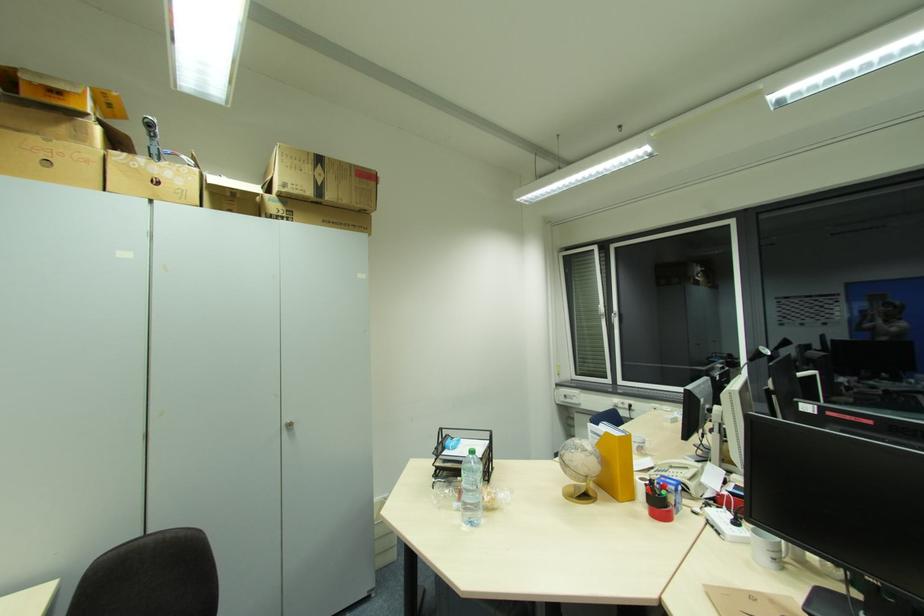
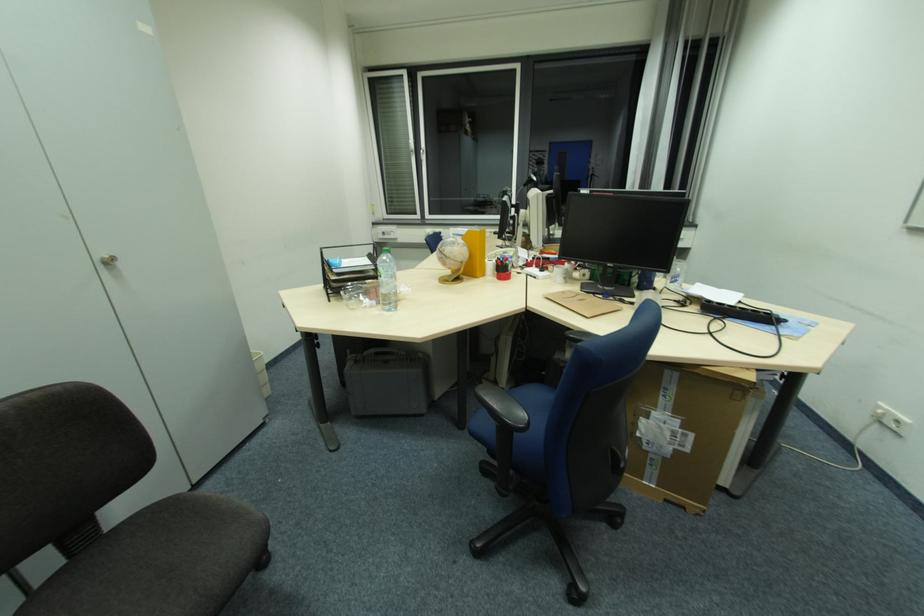
How did the camera likely rotate?

The rotation direction of the camera is right-down.